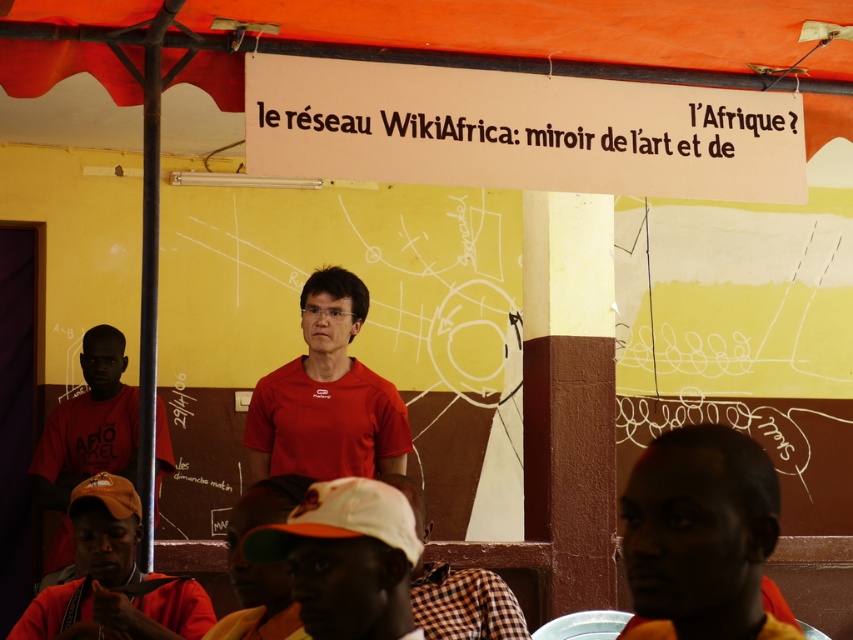
Between point (329, 419) and point (604, 138), which one is positioned behind?

Point (329, 419)

Does matte red shirt at center have a larger size compared to black paper sign at upper center?

Incorrect, matte red shirt at center is not larger than black paper sign at upper center.

The width and height of the screenshot is (853, 640). What do you see at coordinates (328, 396) in the screenshot?
I see `matte red shirt at center` at bounding box center [328, 396].

Where is `matte red shirt at center`? matte red shirt at center is located at coordinates (328, 396).

Who is positioned more to the right, white matte cap at lower center or black paper sign at upper center?

Positioned to the right is black paper sign at upper center.

Who is lower down, white matte cap at lower center or black paper sign at upper center?

white matte cap at lower center is below.

Which is in front, point (380, 605) or point (469, 140)?

Point (380, 605) is more forward.

The width and height of the screenshot is (853, 640). Find the location of `white matte cap at lower center`. white matte cap at lower center is located at coordinates coord(346,557).

Can you confirm if orange fabric canopy at upper center is positioned below checkered fabric shirt at center?

Actually, orange fabric canopy at upper center is above checkered fabric shirt at center.

Does orange fabric canopy at upper center appear on the left side of checkered fabric shirt at center?

No, orange fabric canopy at upper center is not to the left of checkered fabric shirt at center.

Locate an element on the screen. This screenshot has width=853, height=640. orange fabric canopy at upper center is located at coordinates coord(549,26).